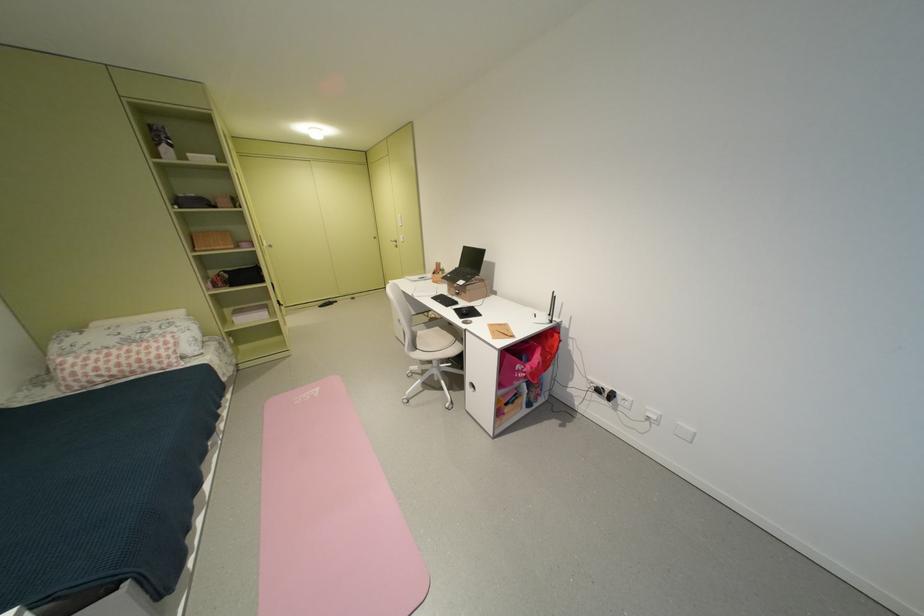
Image resolution: width=924 pixels, height=616 pixels. What are the coordinates of `chair sitting surface` in the screenshot? It's located at (440, 339).